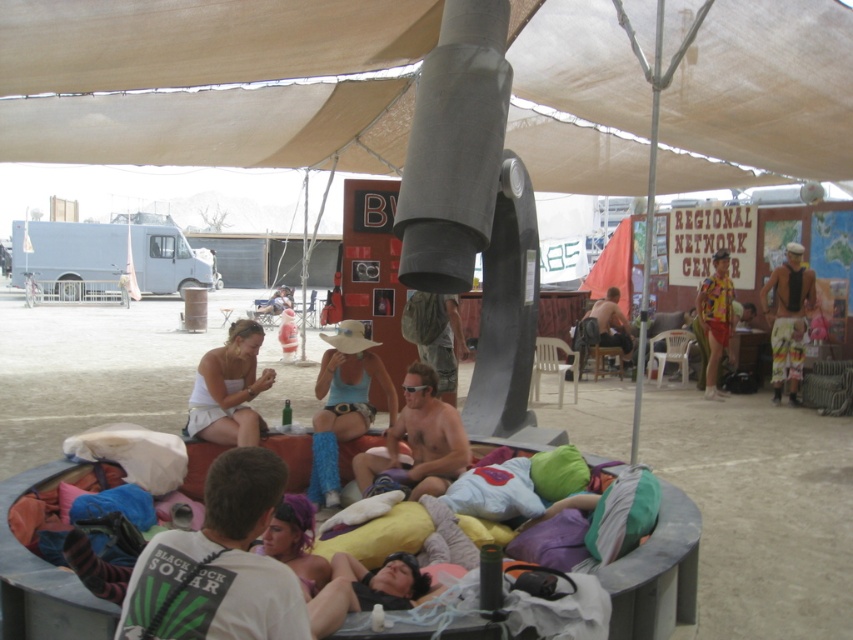
Does purple fabric at center appear on the right side of matte white plastic bag at center?

Correct, you'll find purple fabric at center to the right of matte white plastic bag at center.

Does purple fabric at center appear on the left side of matte white plastic bag at center?

In fact, purple fabric at center is to the right of matte white plastic bag at center.

Locate an element on the screen. purple fabric at center is located at coordinates (294, 541).

Where is `purple fabric at center`? This screenshot has height=640, width=853. purple fabric at center is located at coordinates (294, 541).

Does shiny silver sunglasses at center appear on the right side of white fabric skirt at center?

Yes, shiny silver sunglasses at center is to the right of white fabric skirt at center.

At what (x,y) coordinates should I click in order to perform the action: click on shiny silver sunglasses at center. Please return your answer as a coordinate pair (x, y). This screenshot has height=640, width=853. Looking at the image, I should click on (419, 440).

I want to click on shiny silver sunglasses at center, so click(x=419, y=440).

Describe the element at coordinates (219, 564) in the screenshot. This screenshot has width=853, height=640. I see `white t-shirt at lower center` at that location.

Which is behind, point (194, 532) or point (607, 321)?

Point (607, 321)

What are the coordinates of `white t-shirt at lower center` in the screenshot? It's located at (219, 564).